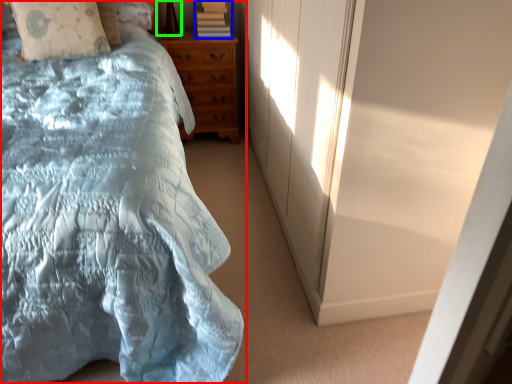
Question: Which object is positioned closest to bed (highlighted by a red box)? Select from book (highlighted by a blue box) and table lamp (highlighted by a green box).

Choices:
 (A) book
 (B) table lamp

Answer: (A)